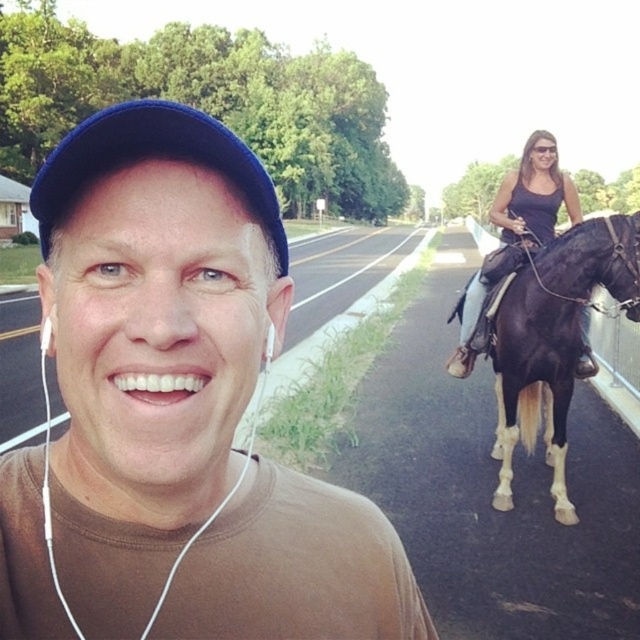
You are a photographer trying to focus on the man in the foreground. You notice a point at coordinates [176,412]. What object is located at that point?

The point at coordinates [176,412] indicates the brown matte tshirt at center.